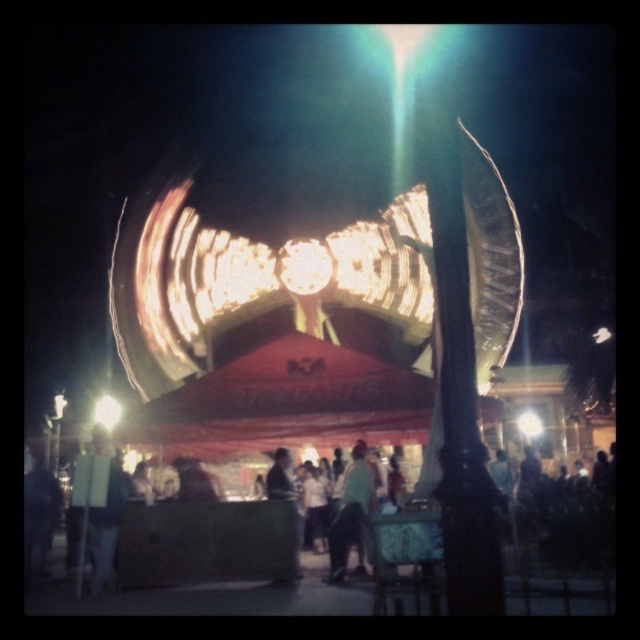
In the scene shown: Who is more forward, [348,545] or [97,406]?

Positioned in front is point [348,545].

The width and height of the screenshot is (640, 640). Describe the element at coordinates (352, 509) in the screenshot. I see `light blue jeans at center` at that location.

Image resolution: width=640 pixels, height=640 pixels. I want to click on light blue jeans at center, so click(x=352, y=509).